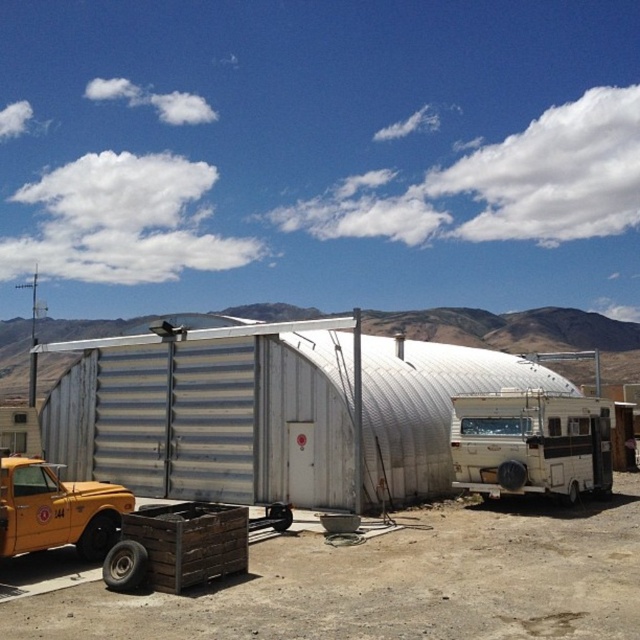
You are standing in the desert scene and want to walk from the silver corrugated metal shed at center to the white matte trailer truck at right. Which direction should you head to get there?

Since the silver corrugated metal shed at center is closer to the viewer than the white matte trailer truck at right, you should head towards the right direction to reach the white matte trailer truck at right.

You are standing in the desert and want to walk from the yellow matte truck at lower left to the silver corrugated metal shed at center. Which direction should you move relative to the truck?

You should move towards the silver corrugated metal shed at center, which is in front of the yellow matte truck at lower left since it is closer to the viewer.

You are standing at the entrance of the rural area and want to park your car between the silver corrugated metal shed at center and the white matte trailer truck at right. Is there enough space between them to fit your car, which is 2 meters wide?

The silver corrugated metal shed at center is to the left of the white matte trailer truck at right, but the distance between them isn